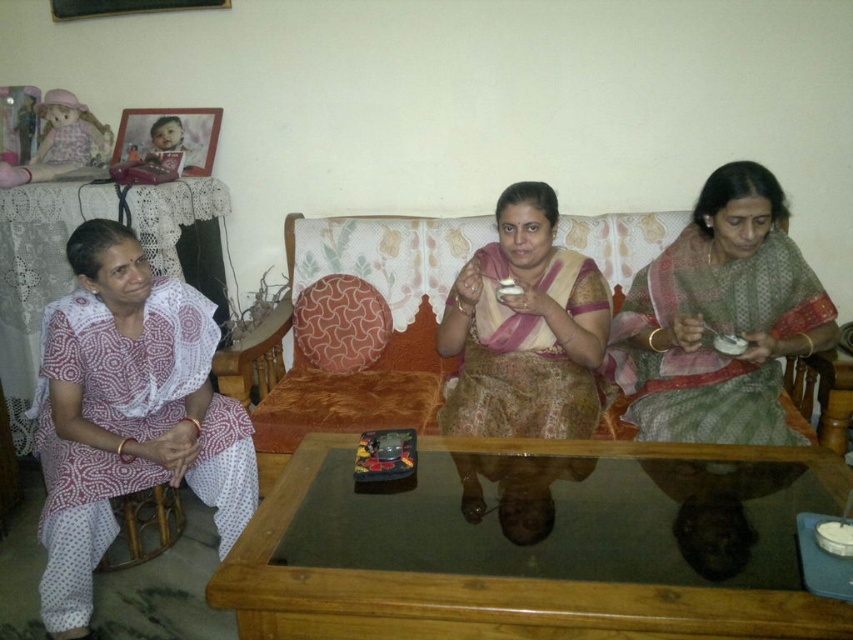
Is white printed fabric at left further to camera compared to velvet orange couch at center?

No, white printed fabric at left is closer to the viewer.

Is point (107, 435) positioned after point (399, 419)?

No, it is not.

Where is `white printed fabric at left`? This screenshot has height=640, width=853. white printed fabric at left is located at coordinates [x=126, y=413].

Who is lower down, green woven sari at center or matte pink saree at center?

matte pink saree at center

Does point (782, 220) come farther from viewer compared to point (540, 198)?

Yes, it is.

Where is `green woven sari at center`? This screenshot has height=640, width=853. green woven sari at center is located at coordinates (720, 317).

Between green woven sari at center and velvet orange couch at center, which one is positioned higher?

Positioned higher is green woven sari at center.

Does green woven sari at center have a smaller size compared to velvet orange couch at center?

Yes.

Who is more distant from viewer, (672, 248) or (415, 240)?

Positioned behind is point (415, 240).

Locate an element on the screen. The image size is (853, 640). green woven sari at center is located at coordinates (720, 317).